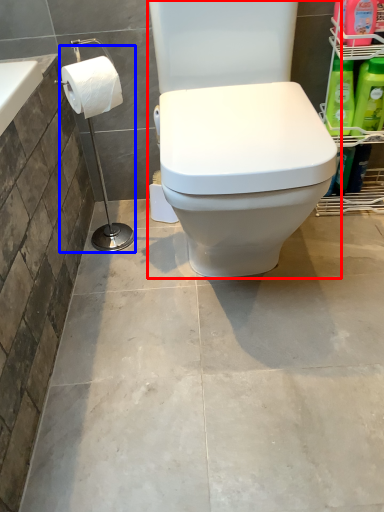
Question: Which object is further to the camera taking this photo, toilet (highlighted by a red box) or shower (highlighted by a blue box)?

Choices:
 (A) toilet
 (B) shower

Answer: (B)